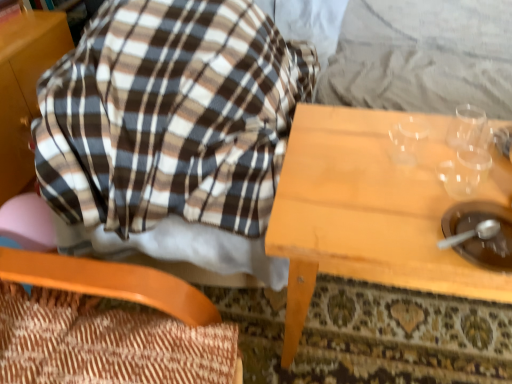
Question: In terms of width, does brown plaid blanket at upper left look wider or thinner when compared to wooden textured chair at left?

Choices:
 (A) wide
 (B) thin

Answer: (A)

Question: Would you say brown plaid blanket at upper left is inside or outside wooden textured chair at left?

Choices:
 (A) inside
 (B) outside

Answer: (B)

Question: Which object is the closest to the brown matte bowl at lower right?

Choices:
 (A) wooden table at center
 (B) brown plaid blanket at upper left
 (C) wooden textured chair at left

Answer: (A)

Question: Estimate the real-world distances between objects in this image. Which object is closer to the brown plaid blanket at upper left?

Choices:
 (A) wooden table at center
 (B) brown matte bowl at lower right
 (C) wooden textured chair at left

Answer: (A)